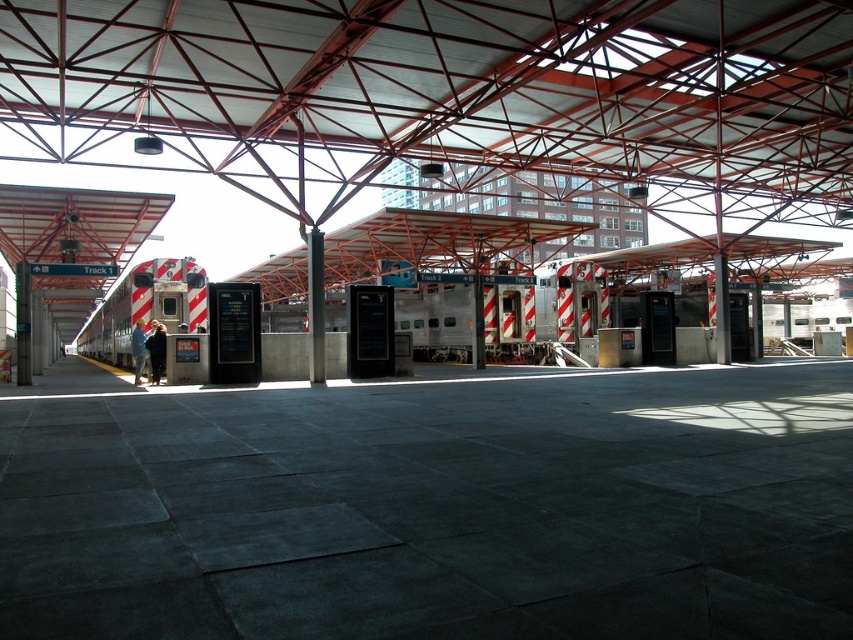
Can you confirm if silver metallic train at center is wider than silver metallic train at left?

Indeed, silver metallic train at center has a greater width compared to silver metallic train at left.

Does silver metallic train at center have a smaller size compared to silver metallic train at left?

No.

Is point (465, 291) farther from viewer compared to point (180, 310)?

Yes, it is.

Identify the location of silver metallic train at center. This screenshot has width=853, height=640. (438, 317).